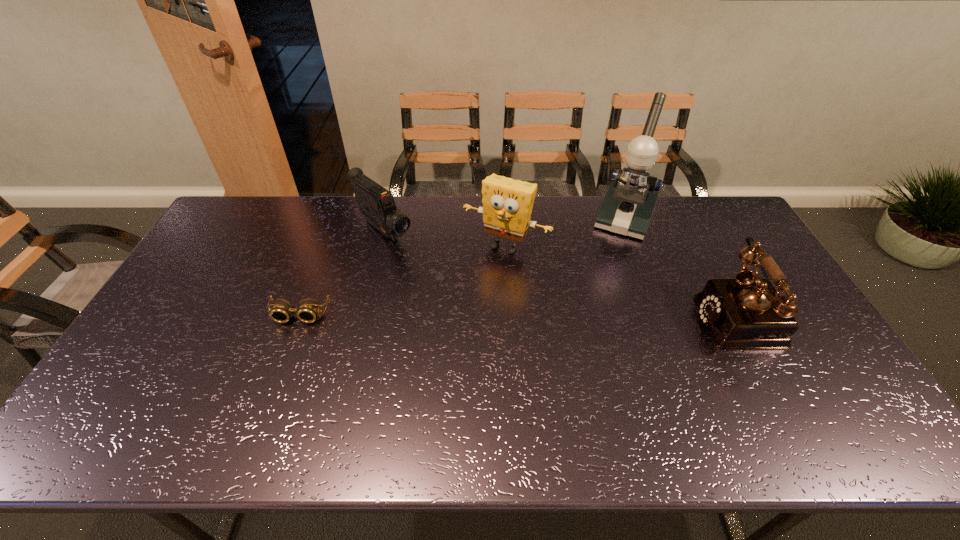
Identify the location of free spot located 0.180m at the eyepiece of the microscope. The image size is (960, 540). (605, 273).

The width and height of the screenshot is (960, 540). What are the coordinates of `free space located 0.360m at the eyepiece of the microscope` in the screenshot? It's located at (589, 312).

Identify the location of free space located on the face of the sponge. (477, 278).

This screenshot has height=540, width=960. In order to click on free point located 0.050m on the face of the sponge in this screenshot , I will do [x=482, y=269].

You are a GUI agent. You are given a task and a screenshot of the screen. Output one action in this format:
    pyautogui.click(x=<x>, y=<y>)
    Task: Click on the vacant space located 0.360m on the face of the sponge
    This screenshot has height=540, width=960.
    Given the screenshot: What is the action you would take?
    pyautogui.click(x=437, y=341)

Find the location of a particular element. This screenshot has height=540, width=960. vacant space located on the front-facing side of the camcorder is located at coordinates (479, 319).

Identify the location of free space located on the front-facing side of the camcorder. Image resolution: width=960 pixels, height=540 pixels. pyautogui.click(x=455, y=298).

Where is `vacant space located 0.280m on the front-facing side of the camcorder`? This screenshot has width=960, height=540. vacant space located 0.280m on the front-facing side of the camcorder is located at coordinates (455, 298).

I want to click on microscope located in the far edge section of the desktop, so click(x=628, y=205).

In order to click on sponge that is at the far edge in this screenshot , I will do `click(507, 203)`.